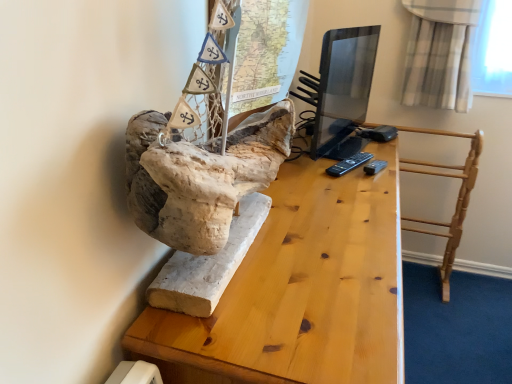
Question: From their relative heights in the image, would you say matte black monitor at center is taller or shorter than light wood/rough table at center?

Choices:
 (A) tall
 (B) short

Answer: (B)

Question: From a real-world perspective, is matte black monitor at center positioned above or below light wood/rough table at center?

Choices:
 (A) above
 (B) below

Answer: (A)

Question: Estimate the real-world distances between objects in this image. Which object is farther from the natural wood table at center?

Choices:
 (A) matte black monitor at center
 (B) light wood/rough table at center

Answer: (A)

Question: Considering the real-world distances, which object is closest to the natural wood table at center?

Choices:
 (A) light wood/rough table at center
 (B) matte black monitor at center

Answer: (A)